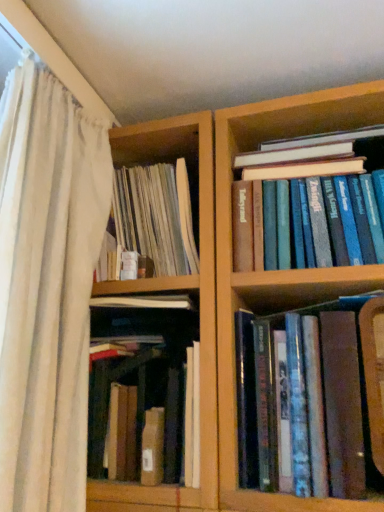
Where is `brown leather book at lower right, the 2th book viewed from the left`? This screenshot has width=384, height=512. brown leather book at lower right, the 2th book viewed from the left is located at coordinates (312, 399).

What is the approximate width of brown leather book at lower right, the 2th book in the right-to-left sequence?

It is 15.22 inches.

Describe the element at coordinates (145, 391) in the screenshot. I see `brown cardboard box at center, the 1th book from the left` at that location.

Find the location of a particular element. The height and width of the screenshot is (512, 384). brown cardboard box at center, which is the 3th book from right to left is located at coordinates (145, 391).

In order to face blue hardcover books at upper right, marked as the first book in a right-to-left arrangement, should I rotate leftwards or rightwards?

A 17.207 degree turn to the right will do.

At what (x,y) coordinates should I click in order to perform the action: click on brown leather book at lower right, the 2th book in the right-to-left sequence. Please return your answer as a coordinate pair (x, y). Image resolution: width=384 pixels, height=512 pixels. Looking at the image, I should click on (312, 399).

Which is more distant, (165, 445) or (351, 473)?

The point (165, 445) is farther.

Is brown cardboard box at center, which is the 3th book from right to left, not within brown leather book at lower right, the 2th book viewed from the left?

Yes.

Considering the sizes of brown cardboard box at center, the 1th book from the left, and brown leather book at lower right, the 2th book in the right-to-left sequence, in the image, is brown cardboard box at center, the 1th book from the left, bigger or smaller than brown leather book at lower right, the 2th book in the right-to-left sequence,?

brown cardboard box at center, the 1th book from the left, is bigger than brown leather book at lower right, the 2th book in the right-to-left sequence.

Is blue hardcover books at upper right, which appears as the 3th book when viewed from the left, beside brown leather book at lower right, the 2th book viewed from the left?

blue hardcover books at upper right, which appears as the 3th book when viewed from the left, and brown leather book at lower right, the 2th book viewed from the left, are not in contact.

Considering their positions, is blue hardcover books at upper right, marked as the first book in a right-to-left arrangement, located in front of or behind brown leather book at lower right, the 2th book in the right-to-left sequence?

blue hardcover books at upper right, marked as the first book in a right-to-left arrangement, is behind brown leather book at lower right, the 2th book in the right-to-left sequence.

Who is bigger, blue hardcover books at upper right, which appears as the 3th book when viewed from the left, or brown leather book at lower right, the 2th book in the right-to-left sequence?

Bigger between the two is brown leather book at lower right, the 2th book in the right-to-left sequence.

Does point (264, 352) come in front of point (23, 155)?

No, it is behind (23, 155).

Which of these two, brown leather book at lower right, the 2th book viewed from the left, or white sheer curtain at left, is bigger?

With larger size is white sheer curtain at left.

From the image's perspective, is brown leather book at lower right, the 2th book viewed from the left, beneath white sheer curtain at left?

Yes, from the image's perspective, brown leather book at lower right, the 2th book viewed from the left, is beneath white sheer curtain at left.

Are brown leather book at lower right, the 2th book viewed from the left, and white sheer curtain at left located far from each other?

Actually, brown leather book at lower right, the 2th book viewed from the left, and white sheer curtain at left are a little close together.

Is brown cardboard box at center, the 1th book from the left, not within blue hardcover books at upper right, marked as the first book in a right-to-left arrangement?

brown cardboard box at center, the 1th book from the left, is positioned outside blue hardcover books at upper right, marked as the first book in a right-to-left arrangement.

This screenshot has width=384, height=512. There is a brown cardboard box at center, which is the 3th book from right to left. Identify the location of the 2nd book above it (from the image's perspective). (311, 202).

Based on the photo, from a real-world perspective, is brown cardboard box at center, which is the 3th book from right to left, positioned above or below blue hardcover books at upper right, which appears as the 3th book when viewed from the left?

From a real-world perspective, brown cardboard box at center, which is the 3th book from right to left, is physically below blue hardcover books at upper right, which appears as the 3th book when viewed from the left.

Between brown cardboard box at center, the 1th book from the left, and blue hardcover books at upper right, which appears as the 3th book when viewed from the left, which one has less height?

blue hardcover books at upper right, which appears as the 3th book when viewed from the left.

How many degrees apart are the facing directions of white sheer curtain at left and brown leather book at lower right, the 2th book viewed from the left?

white sheer curtain at left and brown leather book at lower right, the 2th book viewed from the left, are facing 89.9 degrees away from each other.

Is white sheer curtain at left to the left of brown leather book at lower right, the 2th book viewed from the left, from the viewer's perspective?

Indeed, white sheer curtain at left is positioned on the left side of brown leather book at lower right, the 2th book viewed from the left.

Choose the correct answer: Is white sheer curtain at left inside brown leather book at lower right, the 2th book in the right-to-left sequence, or outside it?

white sheer curtain at left is located beyond the bounds of brown leather book at lower right, the 2th book in the right-to-left sequence.

From a real-world perspective, is white sheer curtain at left on brown leather book at lower right, the 2th book viewed from the left?

Correct, in the physical world, white sheer curtain at left is higher than brown leather book at lower right, the 2th book viewed from the left.

Is brown leather book at lower right, the 2th book viewed from the left, aimed at brown cardboard box at center, which is the 3th book from right to left?

No, brown leather book at lower right, the 2th book viewed from the left, is not aimed at brown cardboard box at center, which is the 3th book from right to left.

From a real-world perspective, is brown leather book at lower right, the 2th book in the right-to-left sequence, over brown cardboard box at center, the 1th book from the left?

Yes, from a real-world perspective, brown leather book at lower right, the 2th book in the right-to-left sequence, is over brown cardboard box at center, the 1th book from the left

Which object is closer to the camera taking this photo, brown leather book at lower right, the 2th book viewed from the left, or brown cardboard box at center, the 1th book from the left?

brown leather book at lower right, the 2th book viewed from the left, is more forward.

Which of these two, blue hardcover books at upper right, marked as the first book in a right-to-left arrangement, or white sheer curtain at left, stands shorter?

blue hardcover books at upper right, marked as the first book in a right-to-left arrangement, is shorter.

Looking at this image, from the image's perspective, is blue hardcover books at upper right, marked as the first book in a right-to-left arrangement, below white sheer curtain at left?

No, from the image's perspective, blue hardcover books at upper right, marked as the first book in a right-to-left arrangement, is not below white sheer curtain at left.

Which book is the 3rd one when counting from the back of the white sheer curtain at left? Please provide its 2D coordinates.

[(311, 202)]

Is blue hardcover books at upper right, which appears as the 3th book when viewed from the left, positioned with its back to white sheer curtain at left?

That's not correct — blue hardcover books at upper right, which appears as the 3th book when viewed from the left, is not looking away from white sheer curtain at left.

From the brown cardboard box at center, which is the 3th book from right to left, count 1st book to the right and point to it. Please provide its 2D coordinates.

[(312, 399)]

From the image's perspective, starting from the blue hardcover books at upper right, which appears as the 3th book when viewed from the left, which book is the 1st one below? Please provide its 2D coordinates.

[(312, 399)]

Looking at the image, which one is located further to blue hardcover books at upper right, marked as the first book in a right-to-left arrangement, brown cardboard box at center, which is the 3th book from right to left, or white sheer curtain at left?

white sheer curtain at left is further to blue hardcover books at upper right, marked as the first book in a right-to-left arrangement.

In the scene shown: Which object lies nearer to the anchor point blue hardcover books at upper right, marked as the first book in a right-to-left arrangement, white sheer curtain at left or brown leather book at lower right, the 2th book viewed from the left?

The object closer to blue hardcover books at upper right, marked as the first book in a right-to-left arrangement, is brown leather book at lower right, the 2th book viewed from the left.

Estimate the real-world distances between objects in this image. Which object is closer to brown cardboard box at center, which is the 3th book from right to left, blue hardcover books at upper right, marked as the first book in a right-to-left arrangement, or white sheer curtain at left?

white sheer curtain at left.

Which object lies nearer to the anchor point brown cardboard box at center, which is the 3th book from right to left, blue hardcover books at upper right, which appears as the 3th book when viewed from the left, or brown leather book at lower right, the 2th book in the right-to-left sequence?

brown leather book at lower right, the 2th book in the right-to-left sequence.

Based on their spatial positions, is blue hardcover books at upper right, marked as the first book in a right-to-left arrangement, or brown cardboard box at center, which is the 3th book from right to left, closer to brown leather book at lower right, the 2th book viewed from the left?

Among the two, brown cardboard box at center, which is the 3th book from right to left, is located nearer to brown leather book at lower right, the 2th book viewed from the left.

Which object lies further to the anchor point blue hardcover books at upper right, marked as the first book in a right-to-left arrangement, brown cardboard box at center, which is the 3th book from right to left, or brown leather book at lower right, the 2th book viewed from the left?

brown cardboard box at center, which is the 3th book from right to left.

Looking at the image, which one is located closer to white sheer curtain at left, brown cardboard box at center, which is the 3th book from right to left, or brown leather book at lower right, the 2th book in the right-to-left sequence?

Among the two, brown cardboard box at center, which is the 3th book from right to left, is located nearer to white sheer curtain at left.

Looking at the image, which one is located further to brown leather book at lower right, the 2th book in the right-to-left sequence, blue hardcover books at upper right, which appears as the 3th book when viewed from the left, or white sheer curtain at left?

white sheer curtain at left is positioned further to the anchor brown leather book at lower right, the 2th book in the right-to-left sequence.

In order to click on book between white sheer curtain at left and brown leather book at lower right, the 2th book in the right-to-left sequence, from left to right in this screenshot , I will do `click(145, 391)`.

Image resolution: width=384 pixels, height=512 pixels. I want to click on book between brown cardboard box at center, which is the 3th book from right to left, and blue hardcover books at upper right, marked as the first book in a right-to-left arrangement, so click(x=312, y=399).